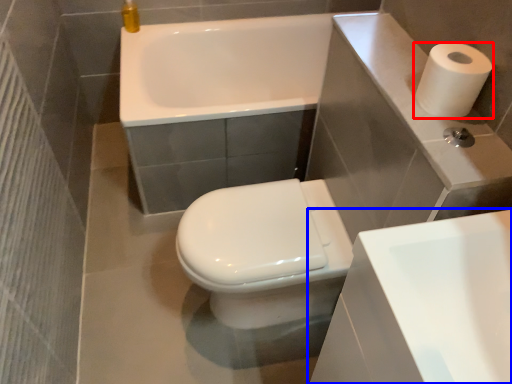
Question: Which point is further to the camera, paper towel (highlighted by a red box) or sink (highlighted by a blue box)?

Choices:
 (A) paper towel
 (B) sink

Answer: (A)